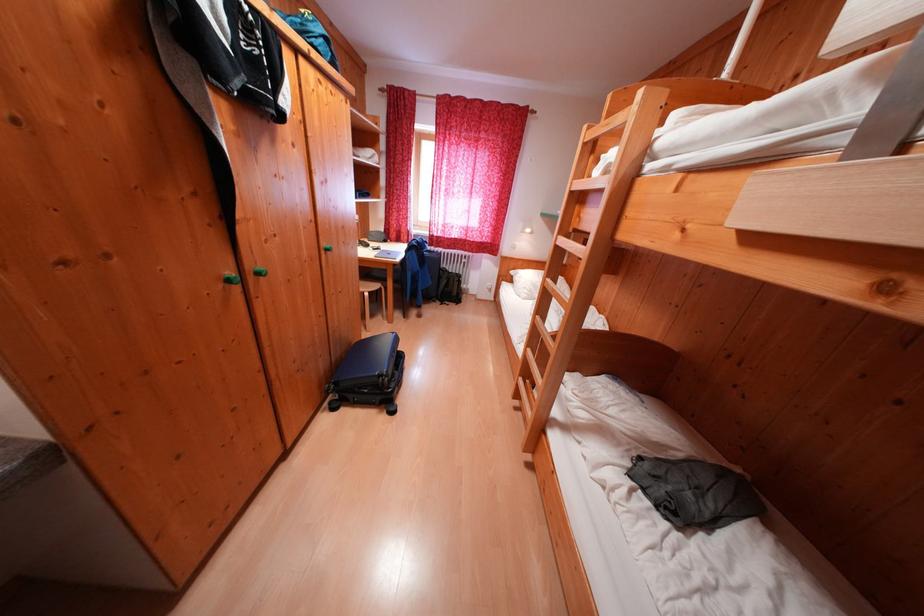
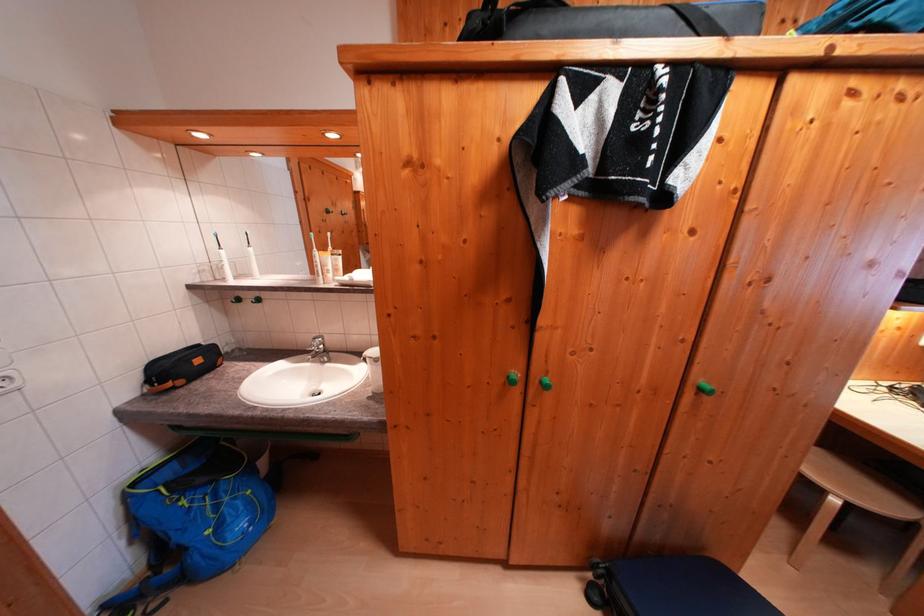
Question: Based on the continuous images, in which direction is the camera rotating? Reply with the corresponding letter.

Choices:
 (A) Left
 (B) Right
 (C) Up
 (D) Down

Answer: (A)